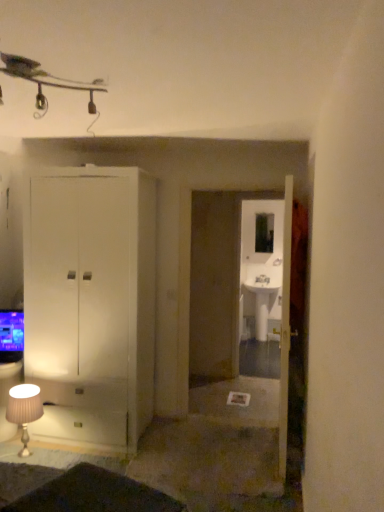
Question: From a real-world perspective, is blue glossy television at lower left positioned above or below clear glass mirror at center?

Choices:
 (A) below
 (B) above

Answer: (A)

Question: Is blue glossy television at lower left taller or shorter than clear glass mirror at center?

Choices:
 (A) short
 (B) tall

Answer: (A)

Question: Which of these objects is positioned closest to the blue glossy television at lower left?

Choices:
 (A) white glossy sink at center
 (B) clear glass mirror at center
 (C) transparent glass sink at center
 (D) white glossy door at center
 (E) white fabric lampshade at lower left

Answer: (E)

Question: Considering the real-world distances, which object is farthest from the white glossy sink at center?

Choices:
 (A) white fabric lampshade at lower left
 (B) blue glossy television at lower left
 (C) clear glass mirror at center
 (D) white glossy door at center
 (E) transparent glass sink at center

Answer: (A)